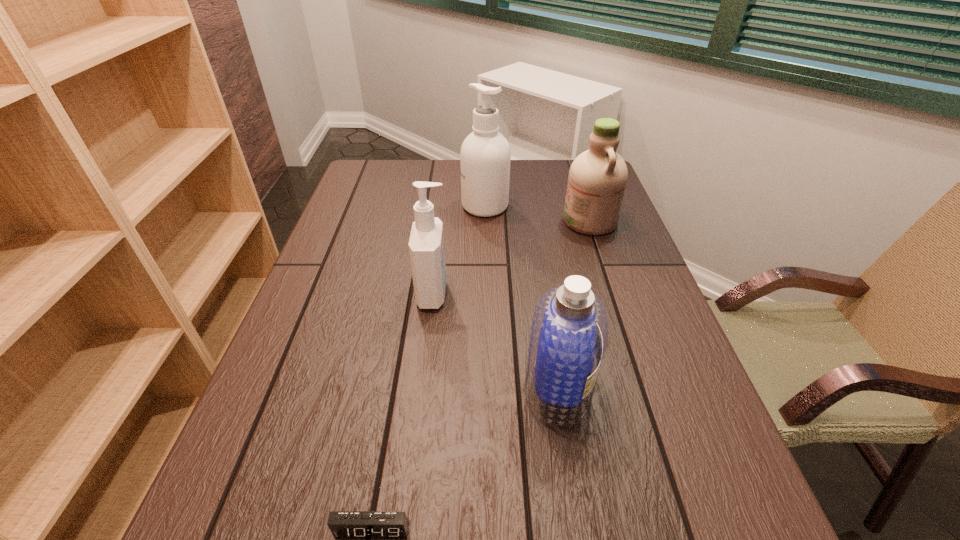
What are the coordinates of `the tallest object` in the screenshot? It's located at (485, 155).

Where is `the rightmost object`? The image size is (960, 540). the rightmost object is located at coordinates (597, 179).

Where is `the third nearest object`? the third nearest object is located at coordinates (426, 244).

At what (x,y) coordinates should I click in order to perform the action: click on the leftmost cleansing agent. Please return your answer as a coordinate pair (x, y). The width and height of the screenshot is (960, 540). Looking at the image, I should click on tap(426, 244).

The width and height of the screenshot is (960, 540). Find the location of `the nearest cleansing agent`. the nearest cleansing agent is located at coordinates (569, 331).

This screenshot has width=960, height=540. Identify the location of the shortest object. (343, 524).

The image size is (960, 540). Find the location of `the nearest object`. the nearest object is located at coordinates (343, 524).

The image size is (960, 540). I want to click on free space located on the front label of the tallest cleansing agent, so click(439, 206).

Locate an element on the screen. Image resolution: width=960 pixels, height=540 pixels. blank space located 0.150m on the front label of the tallest cleansing agent is located at coordinates (412, 206).

Where is `blank space located 0.200m on the front label of the tallest cleansing agent`? The image size is (960, 540). blank space located 0.200m on the front label of the tallest cleansing agent is located at coordinates (396, 206).